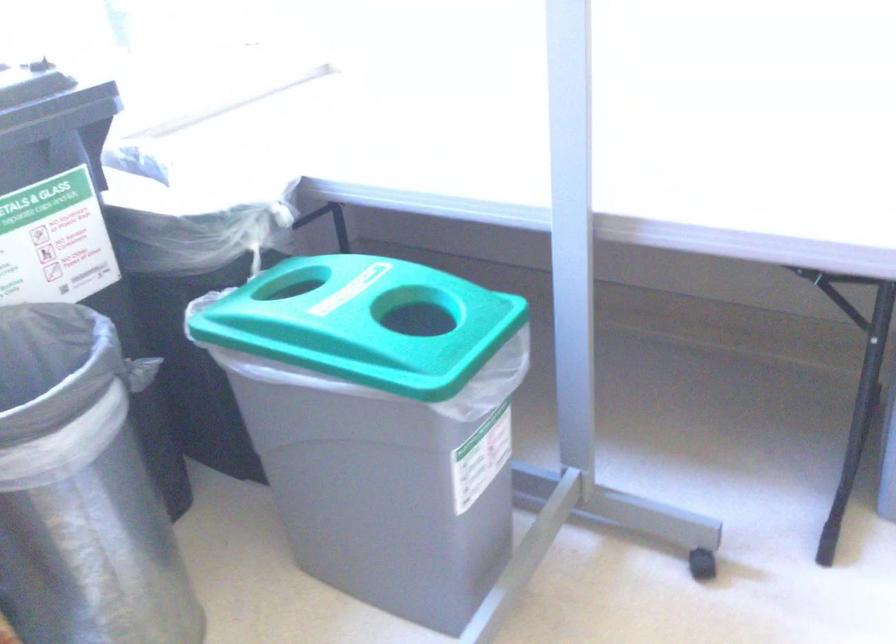
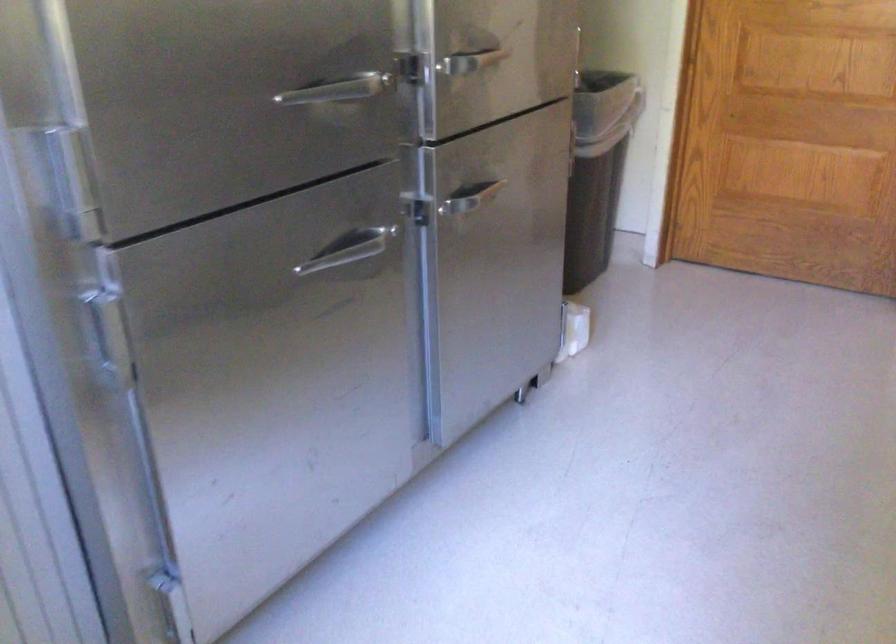
Question: The camera is either moving clockwise (left) or counter-clockwise (right) around the object. The first image is from the beginning of the video and the second image is from the end. Is the camera moving left or right when shooting the video?

Choices:
 (A) Left
 (B) Right

Answer: (A)